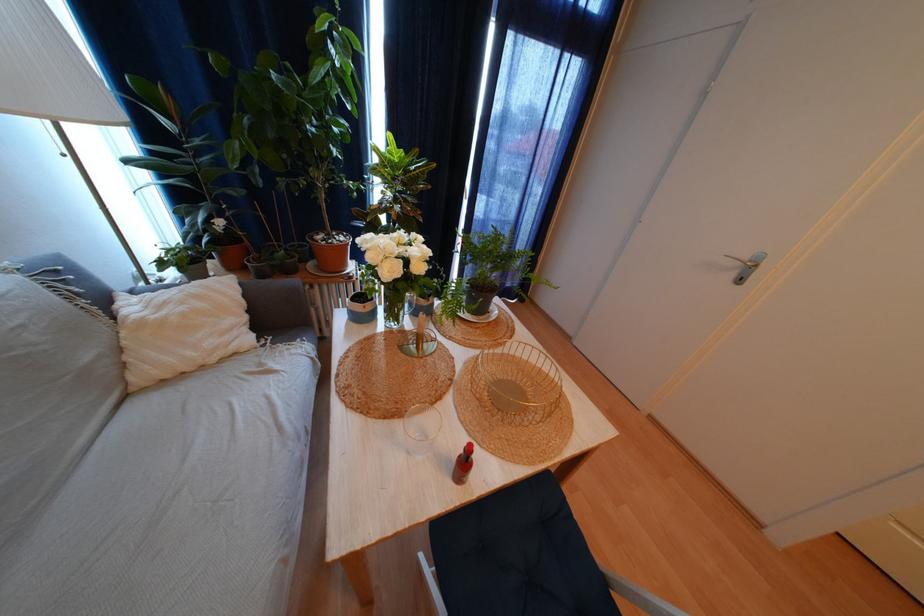
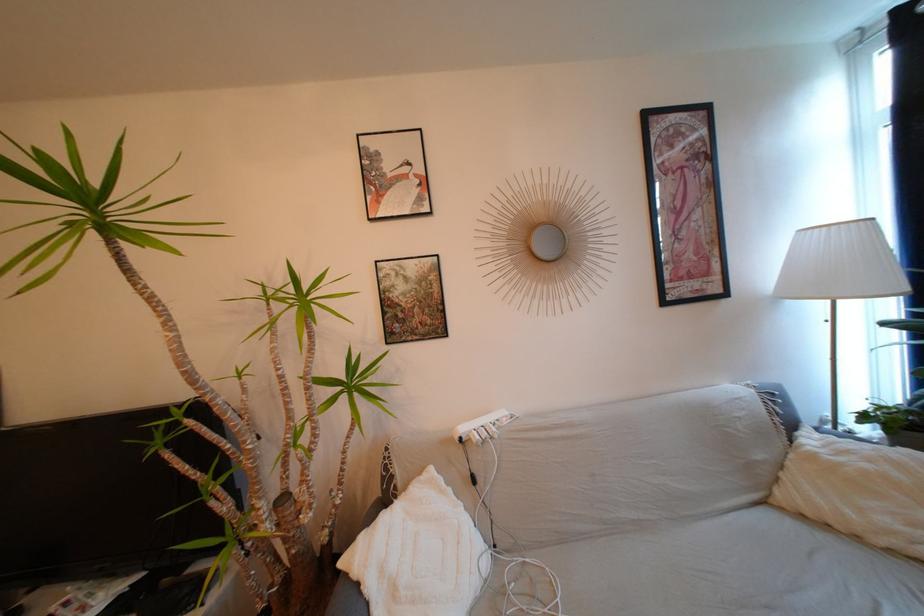
Question: How did the camera likely rotate?

Choices:
 (A) Left
 (B) Right
 (C) Up
 (D) Down

Answer: (A)